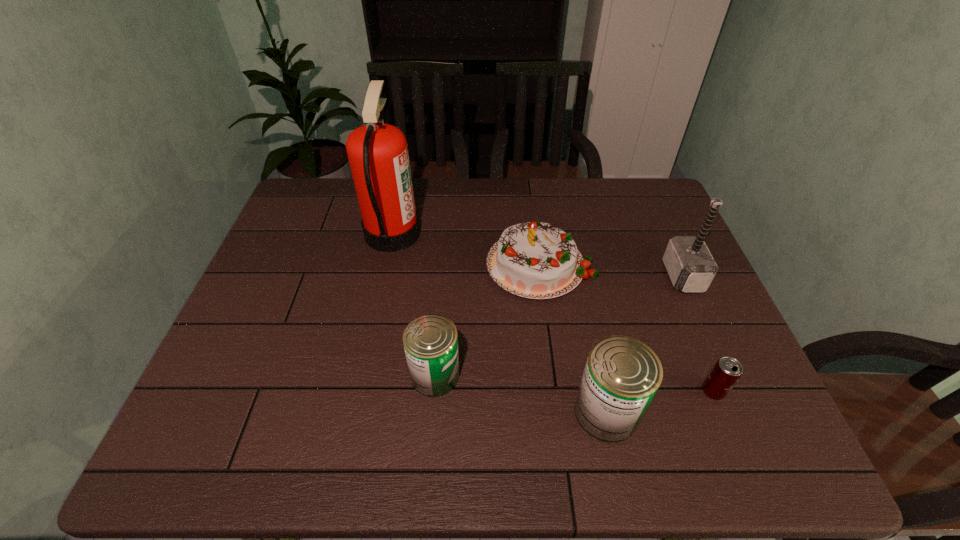
In the current image, all cans are evenly spaced. To maintain this equal spacing, where should an additional can be placed on the left? Please point out a free spot. Please provide its 2D coordinates. Your answer should be formatted as a tuple, i.e. [(x, y)], where the tuple contains the x and y coordinates of a point satisfying the conditions above.

[(284, 342)]